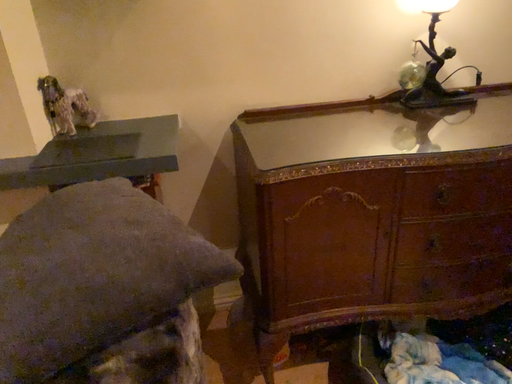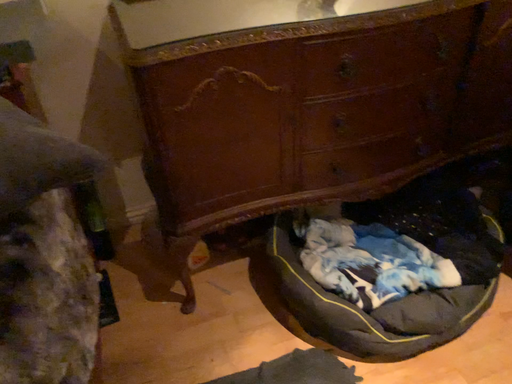
Question: Which way did the camera rotate in the video?

Choices:
 (A) rotated downward
 (B) rotated upward

Answer: (A)